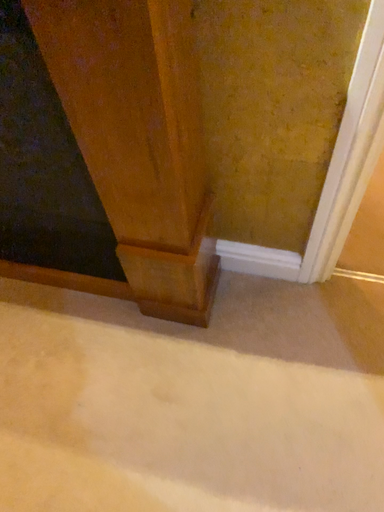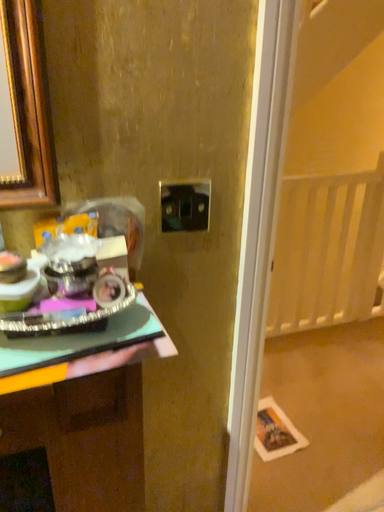
Question: How did the camera likely rotate when shooting the video?

Choices:
 (A) rotated left
 (B) rotated right

Answer: (B)